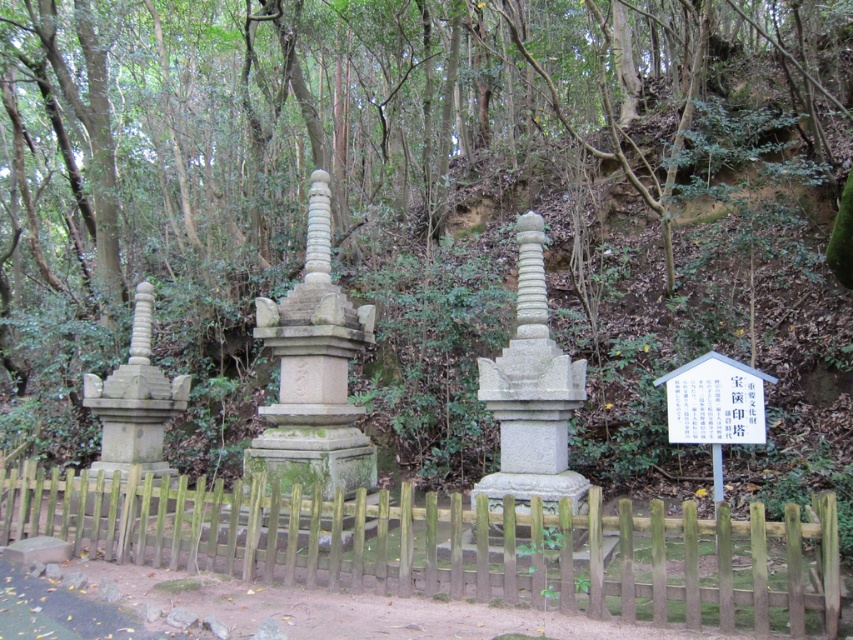
Question: From the image, what is the correct spatial relationship of brown wooden fence at center in relation to gray stone pagoda at center?

Choices:
 (A) above
 (B) below

Answer: (B)

Question: From the image, what is the correct spatial relationship of gray stone pagoda at center in relation to gray stone pillar at center?

Choices:
 (A) above
 (B) below

Answer: (A)

Question: Which point is closer to the camera?

Choices:
 (A) (321, 228)
 (B) (250, 544)

Answer: (B)

Question: Does brown wooden fence at center have a smaller size compared to gray stone pagoda at center?

Choices:
 (A) yes
 (B) no

Answer: (A)

Question: Which is nearer to the brown wooden fence at center?

Choices:
 (A) gray stone pagoda at center
 (B) gray stone pillar at center

Answer: (A)

Question: Which is nearer to the gray stone pagoda at center?

Choices:
 (A) brown wooden fence at center
 (B) gray stone pillar at center

Answer: (A)